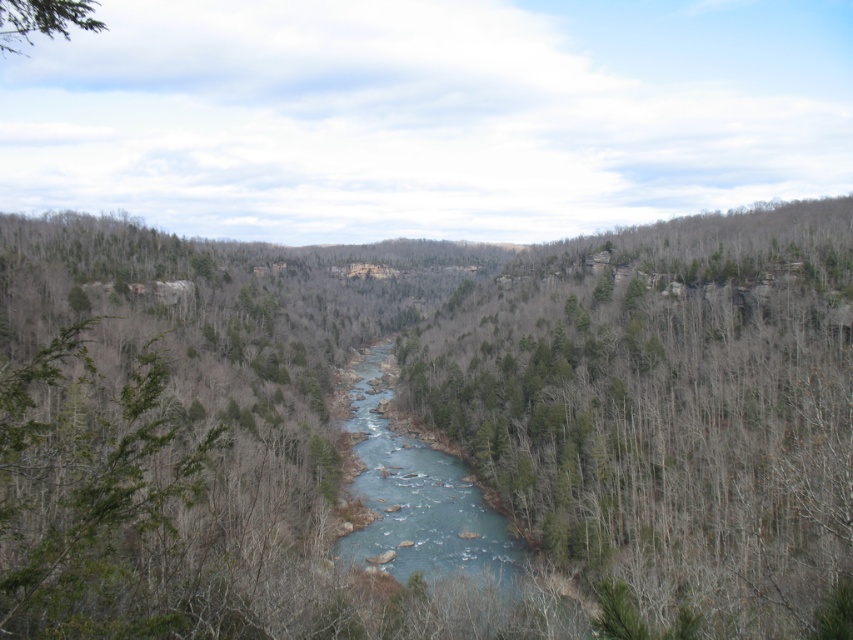
Does point (619, 497) come in front of point (370, 348)?

Yes, point (619, 497) is in front of point (370, 348).

Is point (280, 499) positioned in front of point (468, 502)?

Yes, it is in front of point (468, 502).

Locate an element on the screen. green leafy forest at center is located at coordinates (434, 420).

Between green leafy forest at center and green leafy tree at upper left, which one is positioned higher?

green leafy tree at upper left is above.

Between green leafy forest at center and green leafy tree at upper left, which one appears on the left side from the viewer's perspective?

From the viewer's perspective, green leafy tree at upper left appears more on the left side.

Does point (412, 392) come behind point (15, 51)?

No.

The image size is (853, 640). What are the coordinates of `green leafy forest at center` in the screenshot? It's located at (434, 420).

Who is higher up, blue smooth water at center or green leafy tree at upper left?

green leafy tree at upper left is above.

Does point (498, 582) come in front of point (19, 26)?

No, it is behind (19, 26).

Does point (370, 488) come in front of point (49, 20)?

No, (370, 488) is further to viewer.

Locate an element on the screen. This screenshot has width=853, height=640. blue smooth water at center is located at coordinates (418, 499).